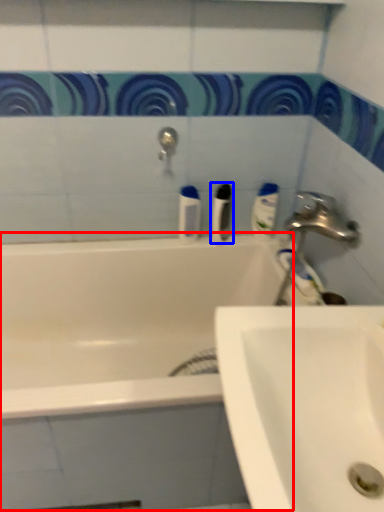
Question: Which point is closer to the camera, bath (highlighted by a red box) or toiletry (highlighted by a blue box)?

Choices:
 (A) bath
 (B) toiletry

Answer: (A)